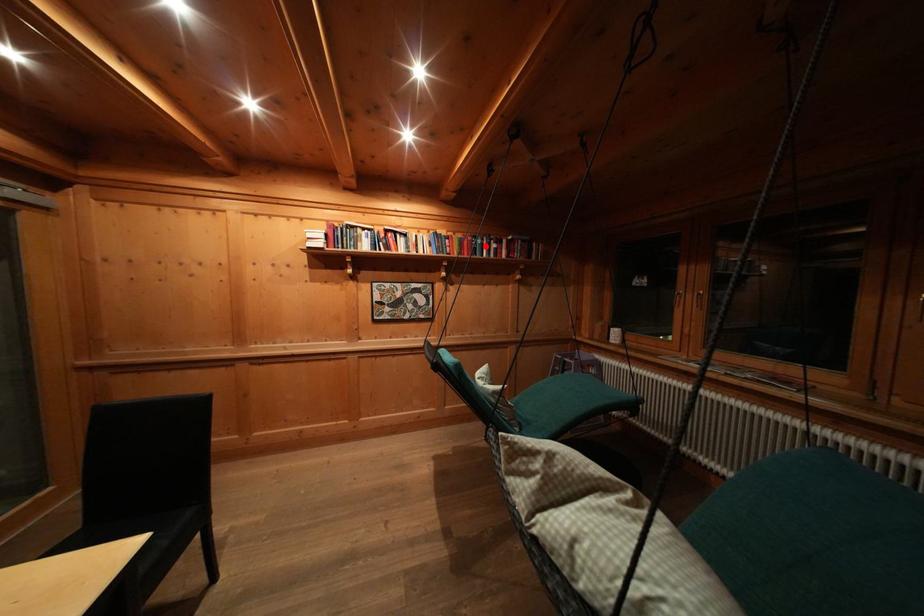
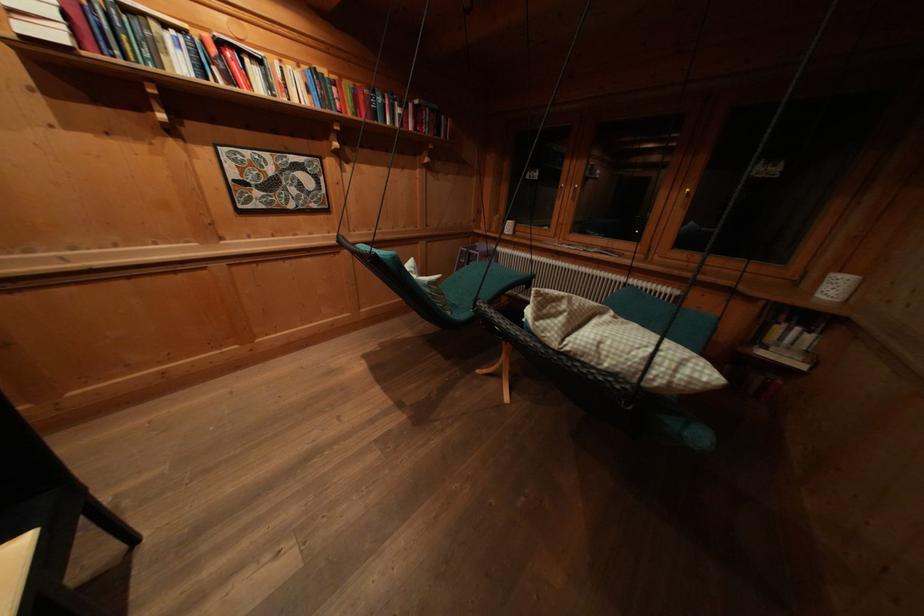
In the second image, find the point that corresponds to the highlighted location in the first image.

(385, 103)